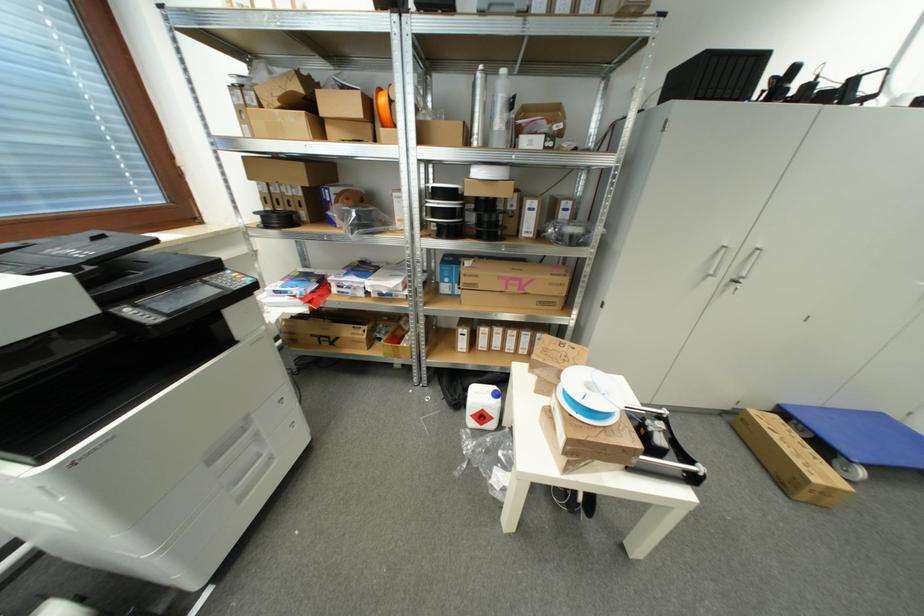
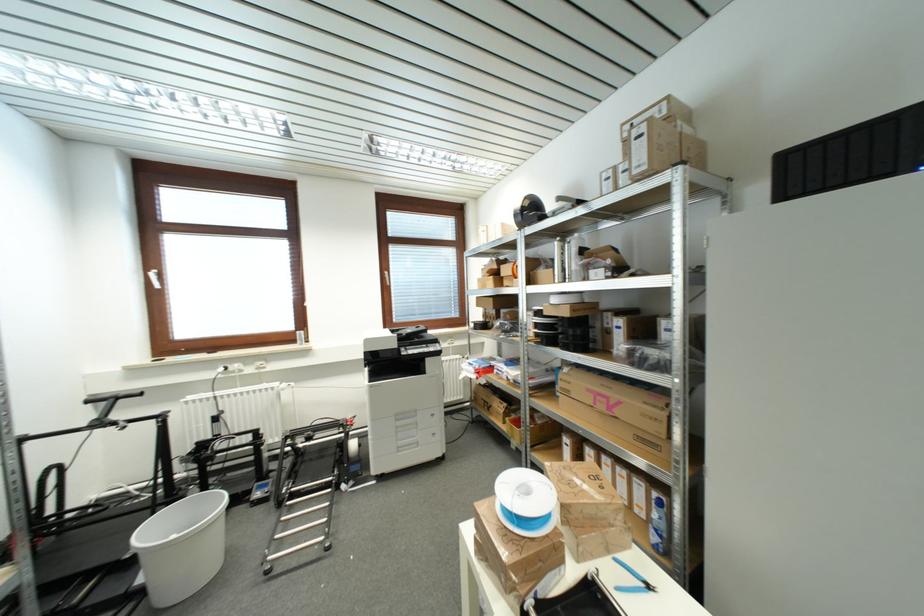
The point at (225,466) is marked in the first image. Where is the corresponding point in the second image?

(404, 426)